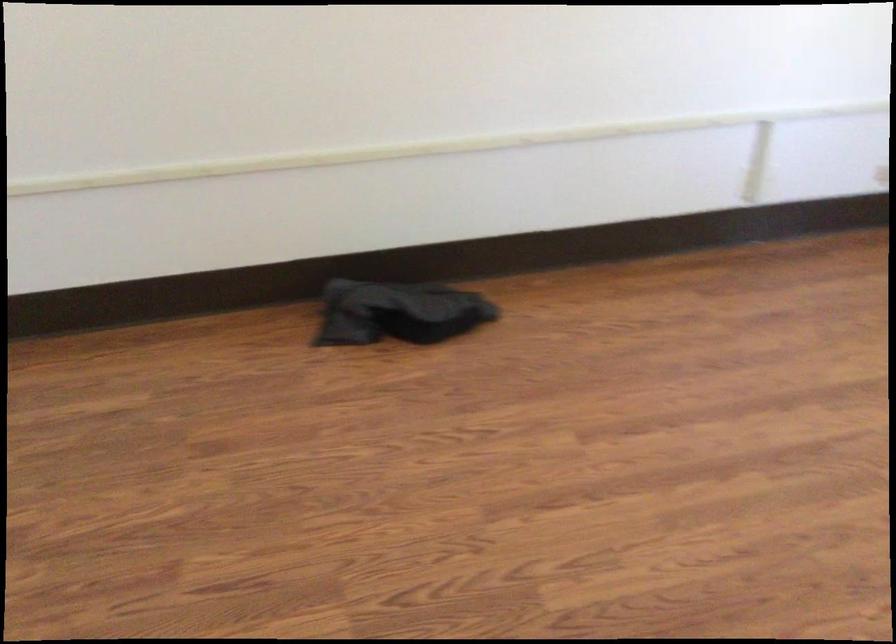
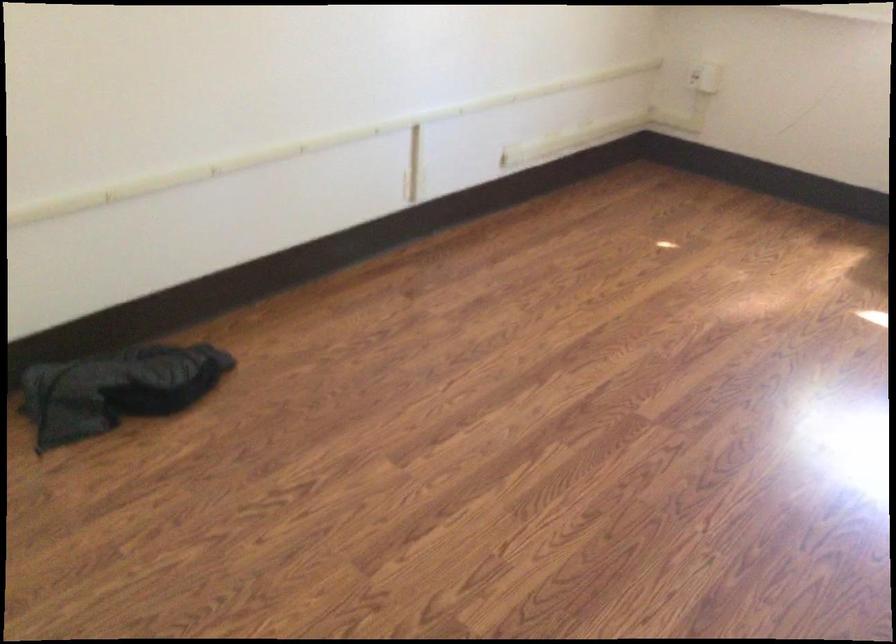
In the second image, find the point that corresponds to (384,308) in the first image.

(116, 389)